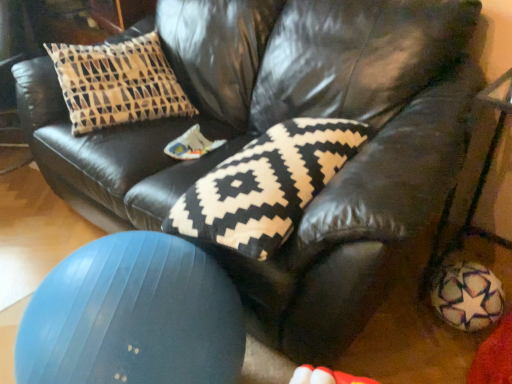
Question: Does blue rubber ball at lower left appear on the left side of black and white knitted pillow at center?

Choices:
 (A) no
 (B) yes

Answer: (B)

Question: Is the surface of blue rubber ball at lower left in direct contact with black and white knitted pillow at center?

Choices:
 (A) no
 (B) yes

Answer: (A)

Question: Is blue rubber ball at lower left positioned behind black and white knitted pillow at center?

Choices:
 (A) yes
 (B) no

Answer: (B)

Question: Does blue rubber ball at lower left have a lesser width compared to black and white knitted pillow at center?

Choices:
 (A) no
 (B) yes

Answer: (B)

Question: Is blue rubber ball at lower left to the right of black and white knitted pillow at center from the viewer's perspective?

Choices:
 (A) no
 (B) yes

Answer: (A)

Question: From a real-world perspective, does blue rubber ball at lower left sit lower than black and white knitted pillow at center?

Choices:
 (A) no
 (B) yes

Answer: (B)

Question: Is black and white knitted pillow at center surrounding blue rubber ball at lower left?

Choices:
 (A) no
 (B) yes

Answer: (A)

Question: Considering the relative sizes of black and white knitted pillow at center and blue rubber ball at lower left in the image provided, is black and white knitted pillow at center bigger than blue rubber ball at lower left?

Choices:
 (A) no
 (B) yes

Answer: (A)

Question: Does black and white knitted pillow at center turn towards blue rubber ball at lower left?

Choices:
 (A) no
 (B) yes

Answer: (B)

Question: Is the position of black and white knitted pillow at center less distant than that of blue rubber ball at lower left?

Choices:
 (A) no
 (B) yes

Answer: (A)

Question: From the image's perspective, is black and white knitted pillow at center below blue rubber ball at lower left?

Choices:
 (A) no
 (B) yes

Answer: (A)

Question: Does black and white knitted pillow at center touch blue rubber ball at lower left?

Choices:
 (A) no
 (B) yes

Answer: (A)

Question: Would you say black and white knitted pillow at center is to the left or to the right of blue rubber ball at lower left in the picture?

Choices:
 (A) right
 (B) left

Answer: (A)